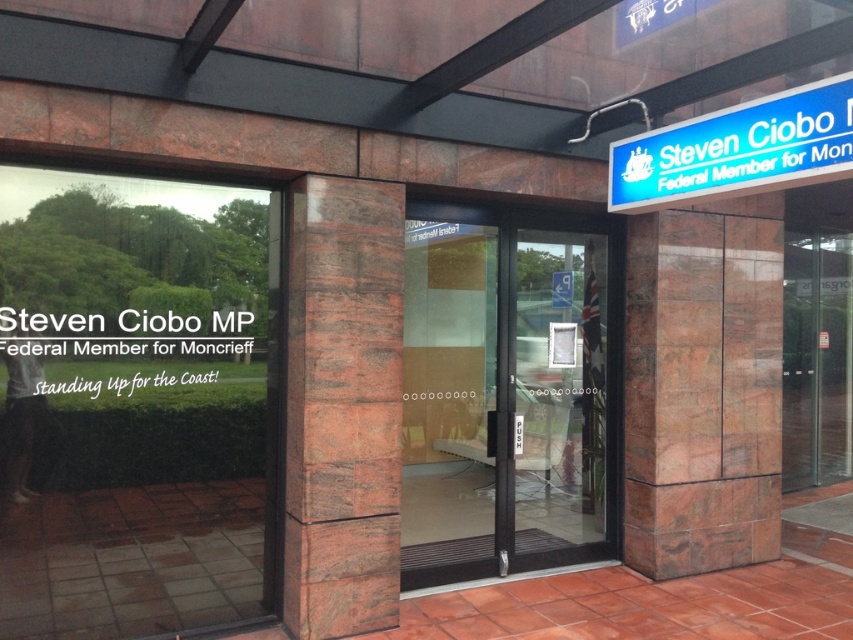
Is point (521, 221) positioned after point (672, 168)?

Yes, it is.

Is black glass door at center positioned behind blue plastic sign at upper right?

Yes.

Is point (461, 422) farther from viewer compared to point (846, 100)?

Yes.

In order to click on black glass door at center in this screenshot , I will do `click(505, 392)`.